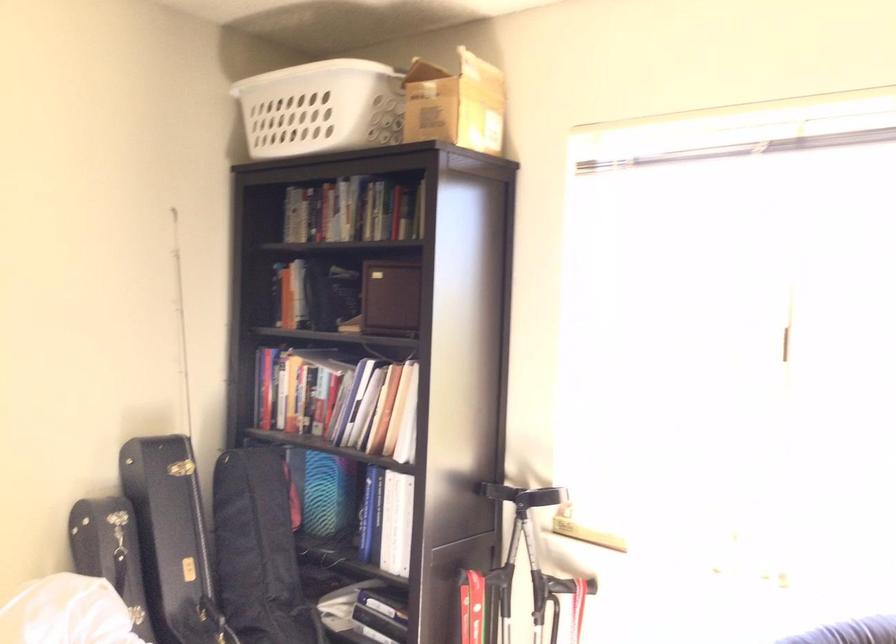
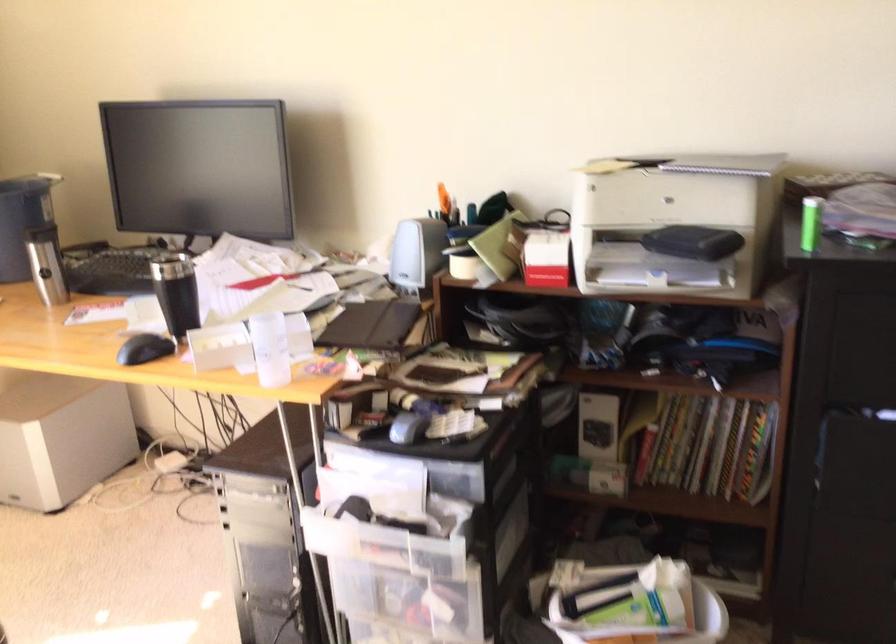
How did the camera likely rotate?

The rotation direction of the camera is right-down.